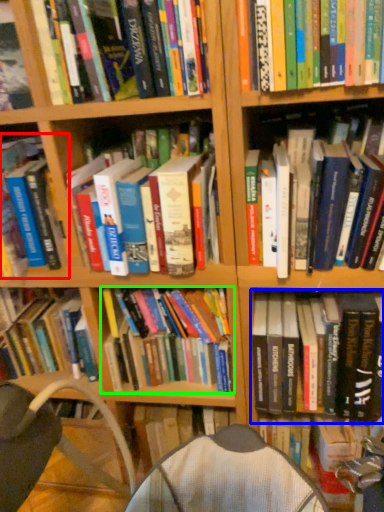
Question: Based on their relative distances, which object is nearer to book (highlighted by a red box)? Choose from book (highlighted by a blue box) and book (highlighted by a green box).

Choices:
 (A) book
 (B) book

Answer: (B)